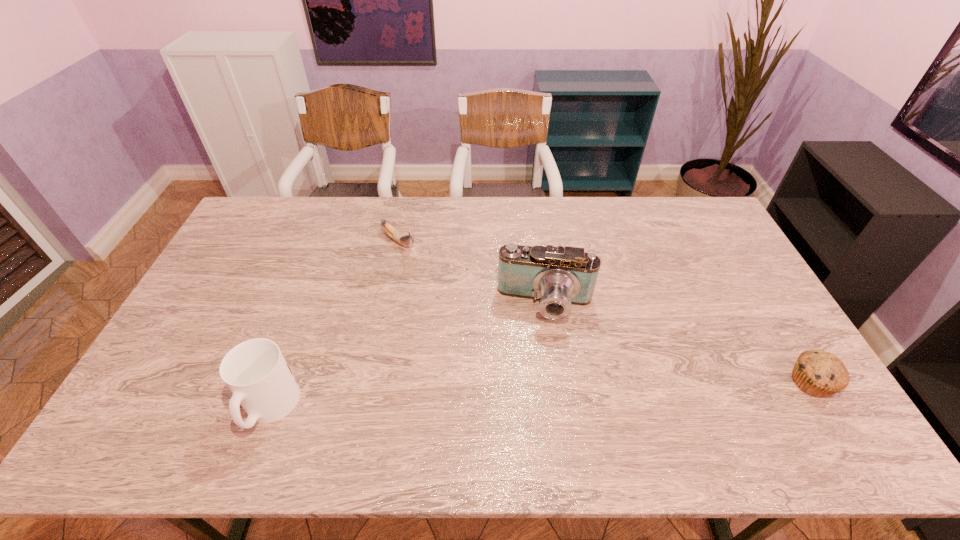
This screenshot has width=960, height=540. What are the coordinates of `vacant space located at the stem of the third object from right to left` in the screenshot? It's located at (435, 268).

At what (x,y) coordinates should I click in order to perform the action: click on free space located at the stem of the third object from right to left. Please return your answer as a coordinate pair (x, y). Looking at the image, I should click on (431, 266).

What are the coordinates of `free space located at the stem of the third object from right to left` in the screenshot? It's located at (455, 284).

The width and height of the screenshot is (960, 540). I want to click on object that is at the far edge, so click(405, 240).

Image resolution: width=960 pixels, height=540 pixels. I want to click on mug that is at the near edge, so click(255, 371).

The height and width of the screenshot is (540, 960). I want to click on muffin that is positioned at the near edge, so click(818, 373).

Locate an element on the screen. object present at the right edge is located at coordinates (818, 373).

Where is `object that is at the near right corner`? The height and width of the screenshot is (540, 960). object that is at the near right corner is located at coordinates (818, 373).

The height and width of the screenshot is (540, 960). I want to click on vacant space at the far edge of the desktop, so click(x=647, y=219).

Find the location of a particular element. This screenshot has width=960, height=540. vacant area at the near edge of the desktop is located at coordinates (694, 403).